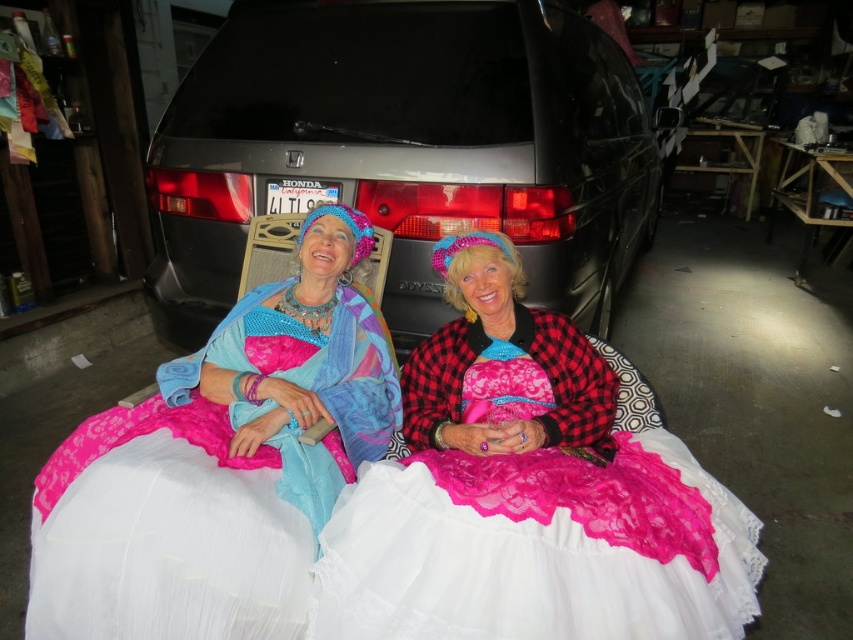
You are a photographer setting up a shoot in a garage. You have a black plastic van at center and a lace fabric dress at center in the scene. Which object is wider?

The black plastic van at center is wider than the lace fabric dress at center because its width surpasses the dress.

You are standing in the garage and want to exit through the door behind the black plastic van at center. The door is 7 feet away from where you are standing. Can you reach the door without moving the van?

The distance between you and the black plastic van at center is 6.31 feet, and the door is 7 feet away. Since the door is slightly farther than the van, you would need to move the van to access the door.

You are standing in the garage and want to take a photo of both point (x=473, y=548) and point (x=148, y=589). Which point should you position yourself closer to in order to ensure both points are fully visible in the frame?

You should position yourself closer to point (x=148, y=589) because point (x=473, y=548) is behind it, so being closer to the front point allows both to be in the frame without obstruction.